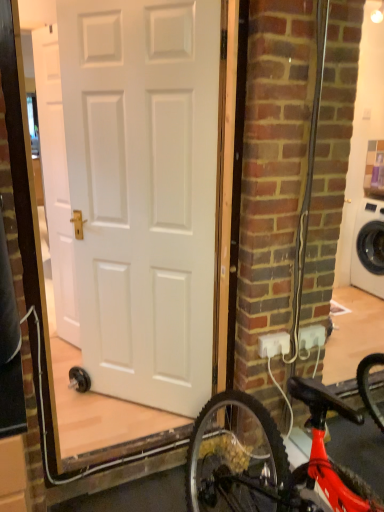
Question: Can you confirm if white matte door at upper left, which is counted as the 1th door, starting from the back, is bigger than white matte door at center, which is counted as the 1th door, starting from the right?

Choices:
 (A) yes
 (B) no

Answer: (B)

Question: Does white matte door at upper left, acting as the 2th door starting from the right, have a smaller size compared to white matte door at center, the first door positioned from the front?

Choices:
 (A) no
 (B) yes

Answer: (B)

Question: Considering the relative sizes of white matte door at upper left, acting as the 2th door starting from the right, and white matte door at center, the second door in the left-to-right sequence, in the image provided, is white matte door at upper left, acting as the 2th door starting from the right, shorter than white matte door at center, the second door in the left-to-right sequence,?

Choices:
 (A) no
 (B) yes

Answer: (B)

Question: Considering the relative sizes of white matte door at upper left, which is counted as the 1th door, starting from the back, and white matte door at center, which is counted as the 1th door, starting from the right, in the image provided, is white matte door at upper left, which is counted as the 1th door, starting from the back, wider than white matte door at center, which is counted as the 1th door, starting from the right,?

Choices:
 (A) no
 (B) yes

Answer: (A)

Question: Is white matte door at upper left, which ranks as the 1th door in left-to-right order, closer to the viewer compared to white matte door at center, which is counted as the 1th door, starting from the right?

Choices:
 (A) yes
 (B) no

Answer: (B)

Question: Can you confirm if white matte door at upper left, which ranks as the 1th door in left-to-right order, is thinner than white matte door at center, positioned as the second door in back-to-front order?

Choices:
 (A) yes
 (B) no

Answer: (A)

Question: Is white matte door at center, positioned as the second door in back-to-front order, oriented towards white plastic outlet at lower right?

Choices:
 (A) yes
 (B) no

Answer: (B)

Question: Is white matte door at center, the second door in the left-to-right sequence, bigger than white plastic outlet at lower right?

Choices:
 (A) yes
 (B) no

Answer: (A)

Question: Would you say white plastic outlet at lower right is part of white matte door at center, the first door positioned from the front,'s contents?

Choices:
 (A) no
 (B) yes

Answer: (A)

Question: Is white matte door at center, the second door in the left-to-right sequence, taller than white plastic outlet at lower right?

Choices:
 (A) no
 (B) yes

Answer: (B)

Question: Can you confirm if white matte door at center, the first door positioned from the front, is thinner than white plastic outlet at lower right?

Choices:
 (A) yes
 (B) no

Answer: (B)

Question: Is white matte door at center, which is counted as the 1th door, starting from the right, turned away from white plastic outlet at lower right?

Choices:
 (A) yes
 (B) no

Answer: (B)

Question: Is white matte door at center, the second door in the left-to-right sequence, to the right of white matte door at upper left, which ranks as the 1th door in left-to-right order, from the viewer's perspective?

Choices:
 (A) yes
 (B) no

Answer: (A)